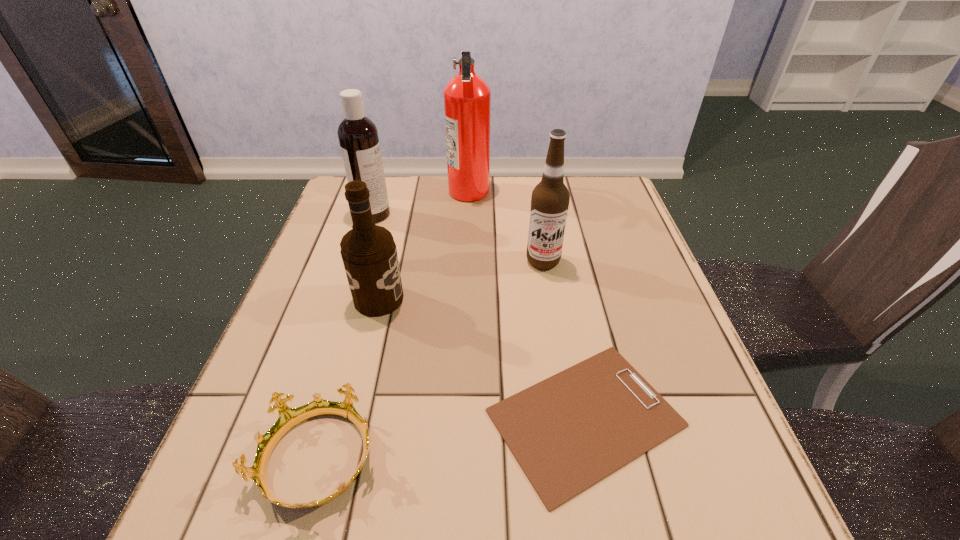
Where is `free point that satisfies the following two spatial constraints: 1. on the label side of the shortest object; 2. on the right side of the dishwasher detergent`? This screenshot has height=540, width=960. free point that satisfies the following two spatial constraints: 1. on the label side of the shortest object; 2. on the right side of the dishwasher detergent is located at coordinates (308, 418).

Locate an element on the screen. This screenshot has height=540, width=960. vacant space that satisfies the following two spatial constraints: 1. on the label side of the dishwasher detergent; 2. on the left side of the shortest object is located at coordinates (308, 418).

Where is `vacant region that satisfies the following two spatial constraints: 1. on the label of the shortest object; 2. on the left side of the farther alcohol`? vacant region that satisfies the following two spatial constraints: 1. on the label of the shortest object; 2. on the left side of the farther alcohol is located at coordinates (568, 418).

The width and height of the screenshot is (960, 540). In order to click on vacant space that satisfies the following two spatial constraints: 1. on the label of the shortest object; 2. on the right side of the right alcohol in this screenshot , I will do `click(568, 418)`.

Locate an element on the screen. Image resolution: width=960 pixels, height=540 pixels. free space that satisfies the following two spatial constraints: 1. on the label of the fourth farthest object; 2. on the front side of the second shortest object is located at coordinates pos(340,460).

Find the location of a particular element. free point that satisfies the following two spatial constraints: 1. on the label of the farther alcohol; 2. on the label of the nearer alcohol is located at coordinates (549, 299).

I want to click on free region that satisfies the following two spatial constraints: 1. on the label of the left alcohol; 2. on the back side of the shortest object, so click(x=350, y=418).